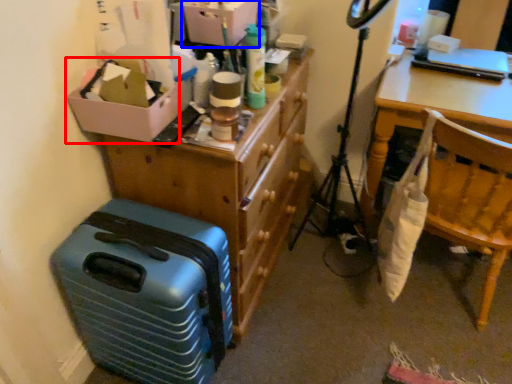
Question: Among these objects, which one is nearest to the camera, box (highlighted by a red box) or storage box (highlighted by a blue box)?

Choices:
 (A) box
 (B) storage box

Answer: (A)